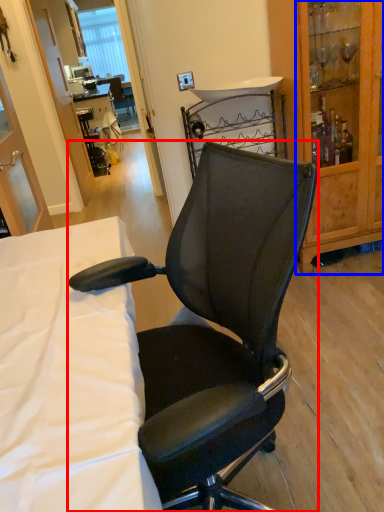
Question: Which point is further to the camera, chair (highlighted by a red box) or cabinetry (highlighted by a blue box)?

Choices:
 (A) chair
 (B) cabinetry

Answer: (B)